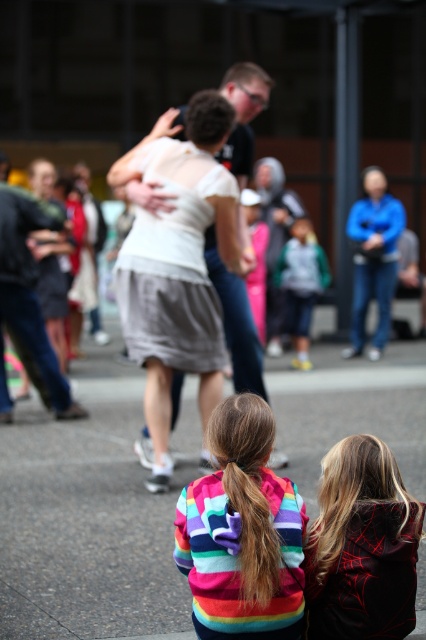
Between rainbow striped sweater at lower center and dark red hoodie at lower right, which one has more height?

rainbow striped sweater at lower center is taller.

Is point (293, 621) less distant than point (344, 477)?

Yes, point (293, 621) is closer to viewer.

The height and width of the screenshot is (640, 426). Identify the location of rainbow striped sweater at lower center. (241, 532).

Is the position of dark red hoodie at lower right more distant than that of matte black jacket at left?

That is False.

Which of these two, dark red hoodie at lower right or matte black jacket at left, stands taller?

matte black jacket at left

Is point (385, 618) more distant than point (39, 342)?

That is False.

This screenshot has width=426, height=640. I want to click on dark red hoodie at lower right, so click(x=362, y=545).

Does gray asphalt pavement at lower center have a smaller size compared to rainbow striped sweater at lower center?

No.

Who is more distant from viewer, (146, 547) or (209, 428)?

The point (146, 547) is more distant.

Between point (363, 392) and point (242, 406), which one is positioned in front?

Point (242, 406) is more forward.

Where is `gray asphalt pavement at lower center`? Image resolution: width=426 pixels, height=640 pixels. gray asphalt pavement at lower center is located at coordinates (92, 513).